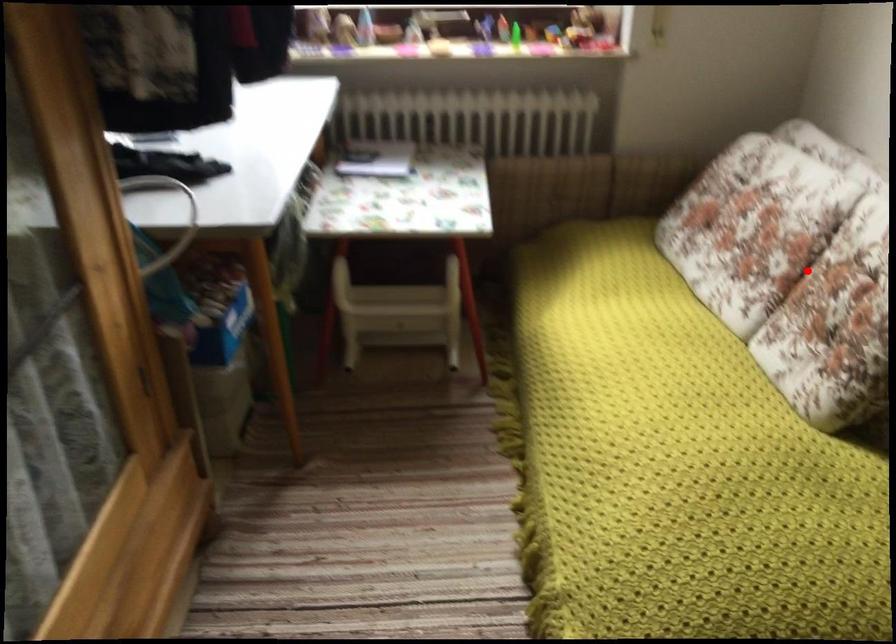
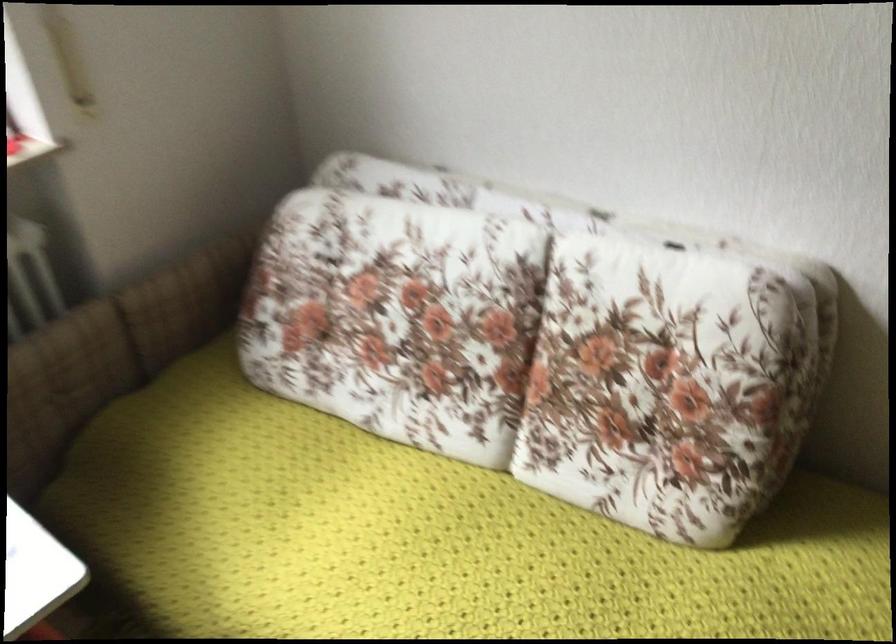
Question: I am providing you with two images of the same scene from different viewpoints. In image1, a red point is highlighted. Considering the same 3D point in image2, which of the following is correct?

Choices:
 (A) It is closer
 (B) It is farther

Answer: (A)